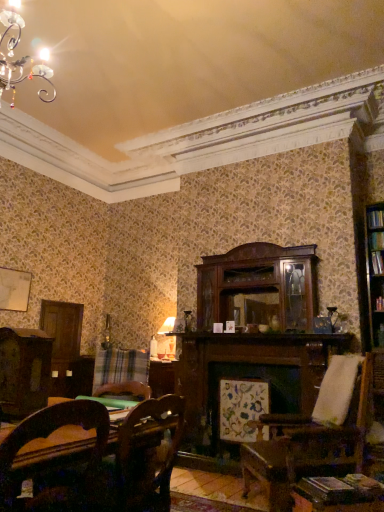
Question: From the image's perspective, is hardcover book at right beneath plaid fabric at lower left?

Choices:
 (A) yes
 (B) no

Answer: (B)

Question: Is hardcover book at right shorter than plaid fabric at lower left?

Choices:
 (A) yes
 (B) no

Answer: (A)

Question: From a real-world perspective, does hardcover book at right stand above plaid fabric at lower left?

Choices:
 (A) no
 (B) yes

Answer: (B)

Question: Is plaid fabric at lower left surrounded by hardcover book at right?

Choices:
 (A) no
 (B) yes

Answer: (A)

Question: Are hardcover book at right and plaid fabric at lower left making contact?

Choices:
 (A) yes
 (B) no

Answer: (B)

Question: From the image's perspective, is plaid fabric at lower left located above or below wooden chair at lower left?

Choices:
 (A) above
 (B) below

Answer: (B)

Question: Based on their positions, is plaid fabric at lower left located to the left or right of wooden chair at lower left?

Choices:
 (A) right
 (B) left

Answer: (B)

Question: In terms of size, does plaid fabric at lower left appear bigger or smaller than wooden chair at lower left?

Choices:
 (A) big
 (B) small

Answer: (B)

Question: In terms of width, does plaid fabric at lower left look wider or thinner when compared to wooden chair at lower left?

Choices:
 (A) wide
 (B) thin

Answer: (B)

Question: Is wooden chair at lower left in front of or behind hardcover book at right in the image?

Choices:
 (A) front
 (B) behind

Answer: (A)

Question: From their relative heights in the image, would you say wooden chair at lower left is taller or shorter than hardcover book at right?

Choices:
 (A) short
 (B) tall

Answer: (B)

Question: Choose the correct answer: Is wooden chair at lower left inside hardcover book at right or outside it?

Choices:
 (A) inside
 (B) outside

Answer: (B)

Question: From a real-world perspective, is wooden chair at lower left positioned above or below hardcover book at right?

Choices:
 (A) above
 (B) below

Answer: (B)

Question: Relative to hardcover book at right, is plaid fabric at lower left in front or behind?

Choices:
 (A) behind
 (B) front

Answer: (B)

Question: In terms of height, does plaid fabric at lower left look taller or shorter compared to hardcover book at right?

Choices:
 (A) short
 (B) tall

Answer: (B)